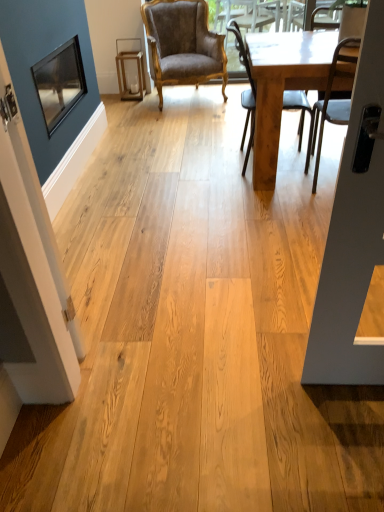
Question: From a real-world perspective, is velvet brown armchair at center, which ranks as the 1th chair in back-to-front order, on light brown wooden chair at center, which ranks as the second chair in right-to-left order?

Choices:
 (A) yes
 (B) no

Answer: (A)

Question: Are velvet brown armchair at center, which is the third chair from right to left, and light brown wooden chair at center, which is the 2th chair in left-to-right order, located far from each other?

Choices:
 (A) yes
 (B) no

Answer: (A)

Question: From a real-world perspective, is velvet brown armchair at center, which appears as the first chair when viewed from the left, below light brown wooden chair at center, which is the 2th chair in left-to-right order?

Choices:
 (A) no
 (B) yes

Answer: (A)

Question: Is velvet brown armchair at center, arranged as the third chair when viewed from the front, positioned beyond the bounds of light brown wooden chair at center, which ranks as the second chair in right-to-left order?

Choices:
 (A) yes
 (B) no

Answer: (A)

Question: Is light brown wooden chair at center, arranged as the 2th chair when viewed from the front, inside velvet brown armchair at center, which ranks as the 1th chair in back-to-front order?

Choices:
 (A) yes
 (B) no

Answer: (B)

Question: From the image's perspective, does velvet brown armchair at center, which appears as the first chair when viewed from the left, appear higher than light brown wooden chair at center, which is the 2th chair in left-to-right order?

Choices:
 (A) no
 (B) yes

Answer: (B)

Question: Is matte black window screen at upper left further to the viewer compared to matte black screen door at left?

Choices:
 (A) yes
 (B) no

Answer: (A)

Question: From a real-world perspective, is matte black window screen at upper left located higher than matte black screen door at left?

Choices:
 (A) yes
 (B) no

Answer: (B)

Question: Considering the relative sizes of matte black window screen at upper left and matte black screen door at left in the image provided, is matte black window screen at upper left thinner than matte black screen door at left?

Choices:
 (A) yes
 (B) no

Answer: (B)

Question: Does matte black window screen at upper left have a greater width compared to matte black screen door at left?

Choices:
 (A) no
 (B) yes

Answer: (B)

Question: Is matte black window screen at upper left oriented towards matte black screen door at left?

Choices:
 (A) yes
 (B) no

Answer: (B)

Question: Is matte black screen door at left a part of matte black window screen at upper left?

Choices:
 (A) no
 (B) yes

Answer: (A)

Question: Is matte black screen door at left positioned behind light brown wooden table at right?

Choices:
 (A) yes
 (B) no

Answer: (B)